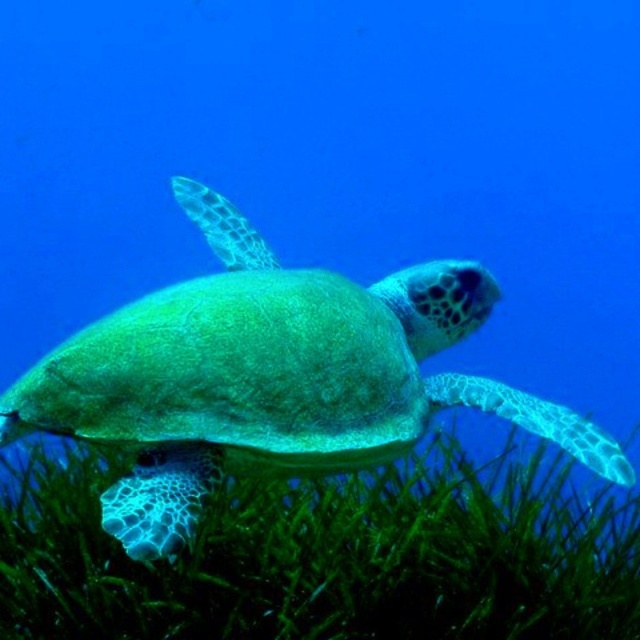
Question: Among these objects, which one is farthest from the camera?

Choices:
 (A) green leafy grass at lower center
 (B) green matte turtle at center

Answer: (A)

Question: Is green leafy grass at lower center bigger than green matte turtle at center?

Choices:
 (A) no
 (B) yes

Answer: (B)

Question: Is green leafy grass at lower center bigger than green matte turtle at center?

Choices:
 (A) no
 (B) yes

Answer: (B)

Question: Is green leafy grass at lower center further to the viewer compared to green matte turtle at center?

Choices:
 (A) yes
 (B) no

Answer: (A)

Question: Which point is closer to the camera?

Choices:
 (A) (176, 317)
 (B) (518, 621)

Answer: (A)